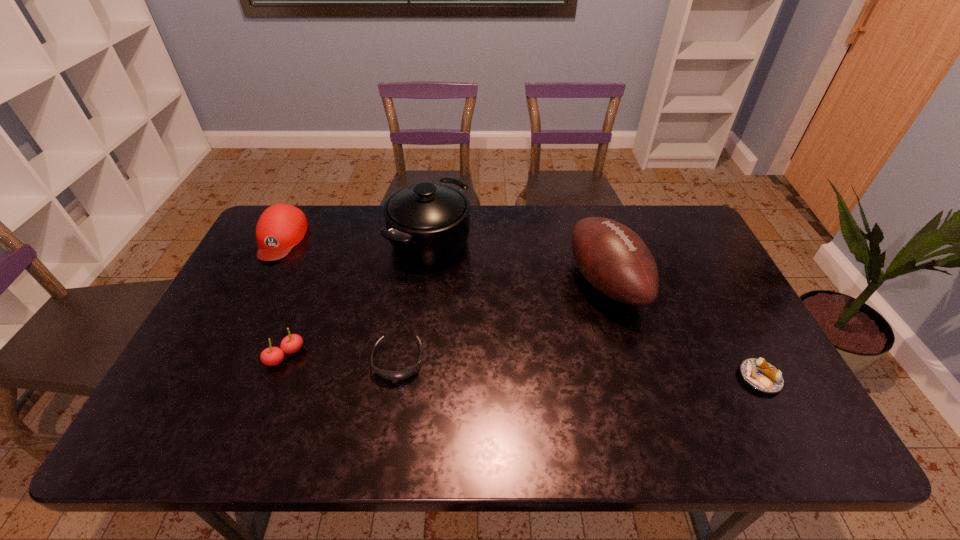
Image resolution: width=960 pixels, height=540 pixels. Identify the location of blank area in the image that satisfies the following two spatial constraints: 1. on the front-facing side of the baseball cap; 2. on the right side of the saucepan. (279, 241).